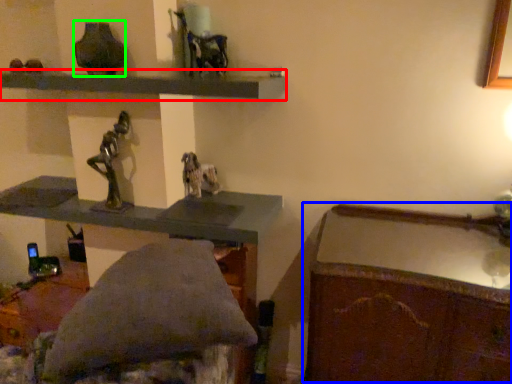
Question: Which is farther away from shelf (highlighted by a red box)? writing desk (highlighted by a blue box) or vase (highlighted by a green box)?

Choices:
 (A) writing desk
 (B) vase

Answer: (A)